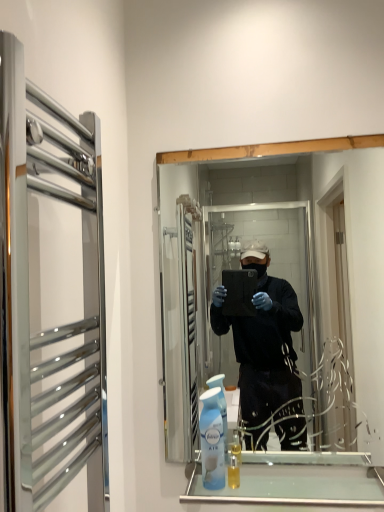
Question: Is clear glass towel rack at left shorter than light blue plastic air freshener at lower center?

Choices:
 (A) yes
 (B) no

Answer: (B)

Question: Is clear glass towel rack at left smaller than light blue plastic air freshener at lower center?

Choices:
 (A) no
 (B) yes

Answer: (A)

Question: Can you confirm if clear glass towel rack at left is wider than light blue plastic air freshener at lower center?

Choices:
 (A) yes
 (B) no

Answer: (A)

Question: Is clear glass towel rack at left beside light blue plastic air freshener at lower center?

Choices:
 (A) yes
 (B) no

Answer: (B)

Question: Is clear glass towel rack at left completely or partially outside of light blue plastic air freshener at lower center?

Choices:
 (A) yes
 (B) no

Answer: (A)

Question: In terms of height, does clear glass towel rack at left look taller or shorter compared to clear glass mirror at center?

Choices:
 (A) short
 (B) tall

Answer: (A)

Question: Visually, is clear glass towel rack at left positioned to the left or to the right of clear glass mirror at center?

Choices:
 (A) right
 (B) left

Answer: (B)

Question: Relative to clear glass mirror at center, is clear glass towel rack at left in front or behind?

Choices:
 (A) behind
 (B) front

Answer: (B)

Question: From a real-world perspective, is clear glass towel rack at left physically located above or below clear glass mirror at center?

Choices:
 (A) below
 (B) above

Answer: (A)

Question: From a real-world perspective, is light blue plastic air freshener at lower center positioned above or below translucent plastic mouthwash at lower center?

Choices:
 (A) above
 (B) below

Answer: (A)

Question: Looking at the image, does light blue plastic air freshener at lower center seem bigger or smaller compared to translucent plastic mouthwash at lower center?

Choices:
 (A) small
 (B) big

Answer: (B)

Question: Is point (213, 442) closer or farther from the camera than point (230, 475)?

Choices:
 (A) farther
 (B) closer

Answer: (B)

Question: Considering the positions of light blue plastic air freshener at lower center and translucent plastic mouthwash at lower center in the image, is light blue plastic air freshener at lower center wider or thinner than translucent plastic mouthwash at lower center?

Choices:
 (A) thin
 (B) wide

Answer: (B)

Question: In terms of size, does clear glass towel rack at left appear bigger or smaller than translucent plastic mouthwash at lower center?

Choices:
 (A) small
 (B) big

Answer: (B)

Question: Is clear glass towel rack at left inside the boundaries of translucent plastic mouthwash at lower center, or outside?

Choices:
 (A) outside
 (B) inside

Answer: (A)